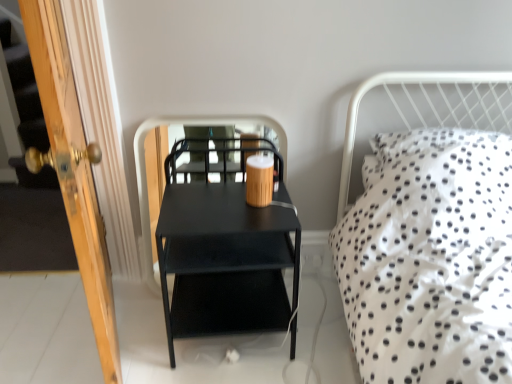
Where is `vacant region to the right of matte black nightstand at center`? vacant region to the right of matte black nightstand at center is located at coordinates (318, 324).